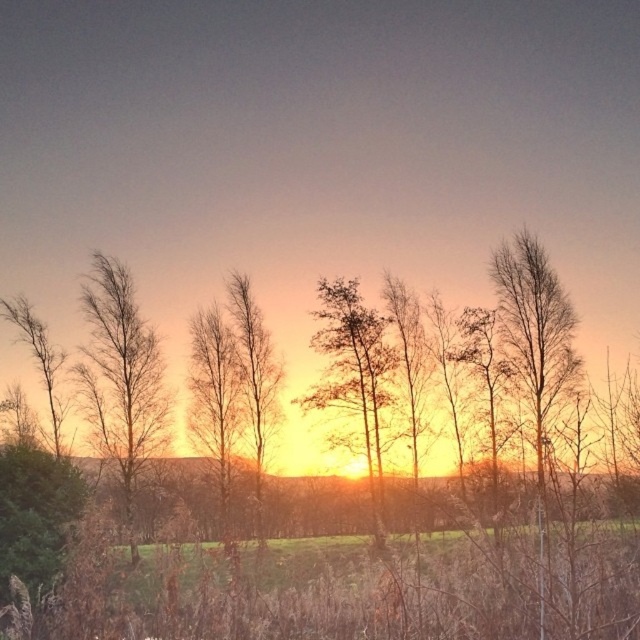
You are a bird looking for a place to perch. You see two options in the image, the bare branches at left and the bare branches at center. Which set of branches is located higher up in the scene?

The bare branches at left is positioned over the bare branches at center, so the bare branches at left are higher up.

You are standing in the sunset scene and see the point marked at coordinates [353,372]. What object is located at that point?

The point at coordinates [353,372] indicates a green leafy tree at center.

You are an artist standing in front of the scene, wanting to paint the bare branches at left and the green leafy tree at center. Which object should you paint first to follow the correct layering technique?

You should paint the bare branches at left first because it is closer to you than the green leafy tree at center, so it should be layered over the background elements.